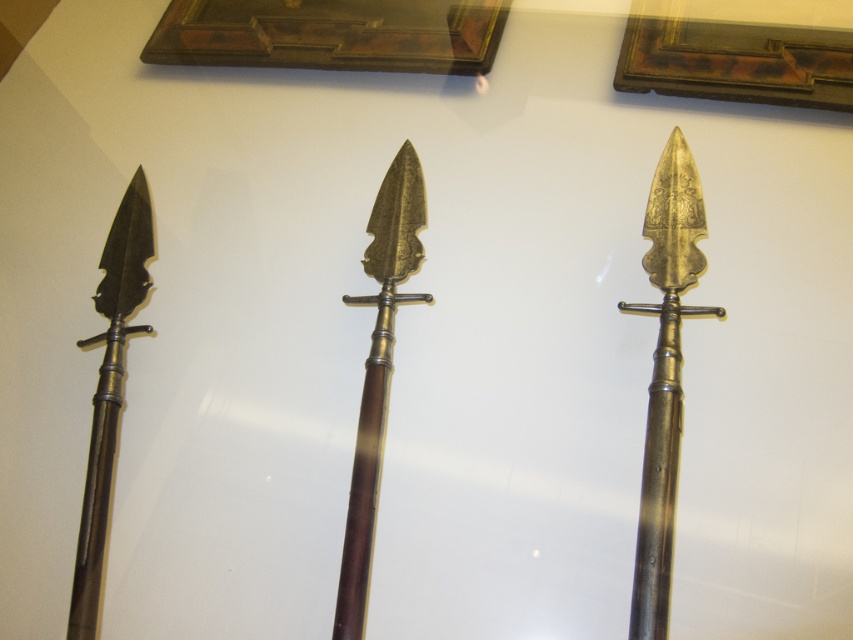
Is gold polished spear at right below gold polished metal spear at center?

Incorrect, gold polished spear at right is not positioned below gold polished metal spear at center.

I want to click on gold polished spear at right, so click(x=665, y=376).

Identify the location of gold polished spear at right. The height and width of the screenshot is (640, 853). pyautogui.click(x=665, y=376).

Can you confirm if gold polished spear at right is wider than matte black spear at left?

Indeed, gold polished spear at right has a greater width compared to matte black spear at left.

Does gold polished spear at right appear under matte black spear at left?

Incorrect, gold polished spear at right is not positioned below matte black spear at left.

Identify the location of gold polished spear at right. (665, 376).

Does gold polished metal spear at center have a lesser width compared to matte black spear at left?

No.

This screenshot has width=853, height=640. Describe the element at coordinates (378, 372) in the screenshot. I see `gold polished metal spear at center` at that location.

Is point (405, 227) less distant than point (117, 337)?

No, (405, 227) is further to viewer.

You are a GUI agent. You are given a task and a screenshot of the screen. Output one action in this format:
    pyautogui.click(x=<x>, y=<y>)
    Task: Click on the gold polished metal spear at center
    The image size is (853, 640).
    Given the screenshot: What is the action you would take?
    pyautogui.click(x=378, y=372)